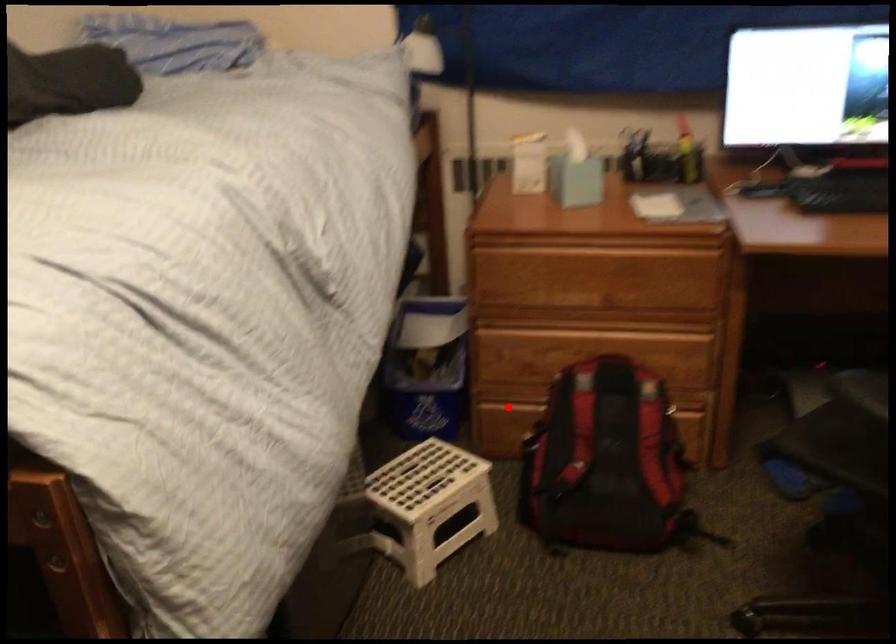
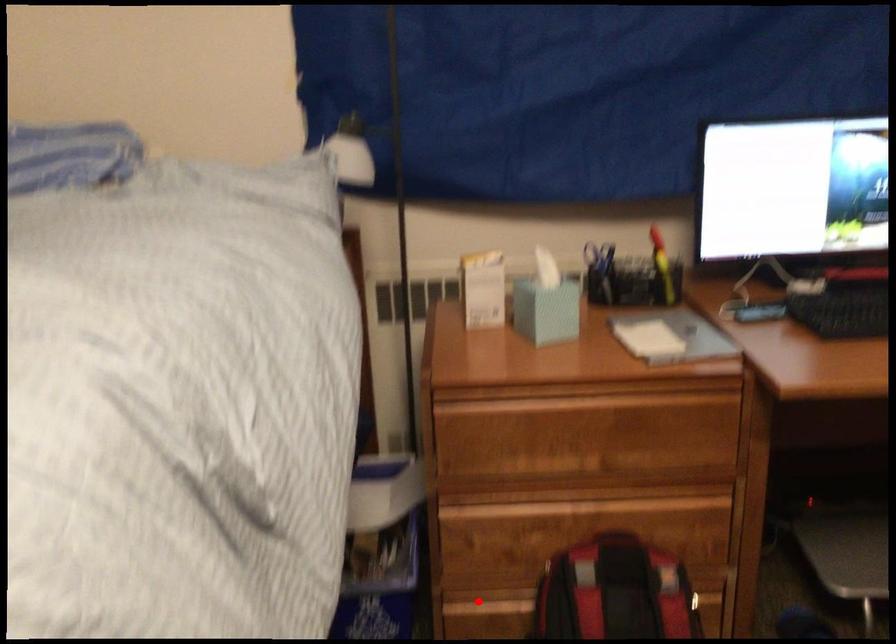
I am providing you with two images of the same scene from different viewpoints. A red point is marked on the first image and another point is marked on the second image. Are the points marked in image1 and image2 representing the same 3D position?

Yes